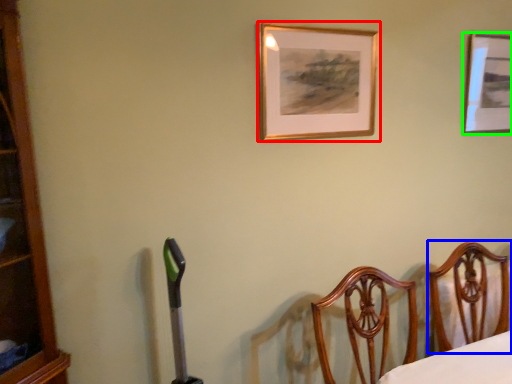
Question: Which object is the farthest from picture frame (highlighted by a red box)? Choose among these: furniture (highlighted by a blue box) or picture frame (highlighted by a green box).

Choices:
 (A) furniture
 (B) picture frame

Answer: (A)